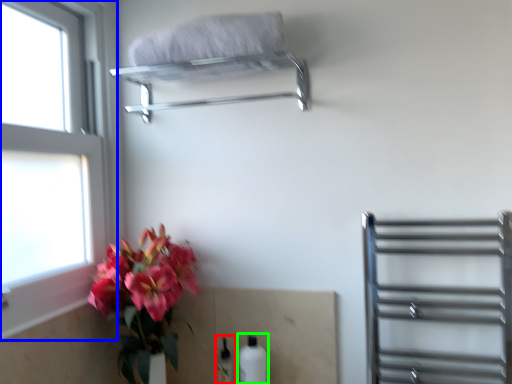
Question: Estimate the real-world distances between objects in this image. Which object is closer to bottle (highlighted by a red box), window (highlighted by a blue box) or bottle (highlighted by a green box)?

Choices:
 (A) window
 (B) bottle

Answer: (B)